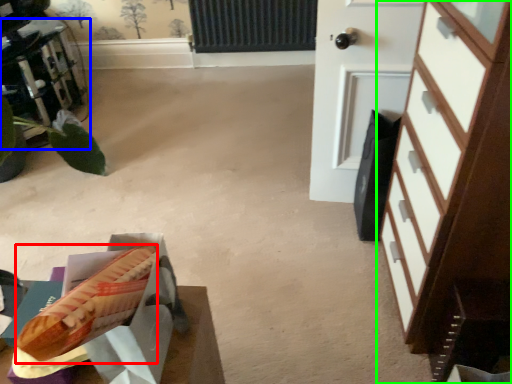
Question: Considering the real-world distances, which object is farthest from hot dog (highlighted by a red box)? furniture (highlighted by a blue box) or chest of drawers (highlighted by a green box)?

Choices:
 (A) furniture
 (B) chest of drawers

Answer: (A)